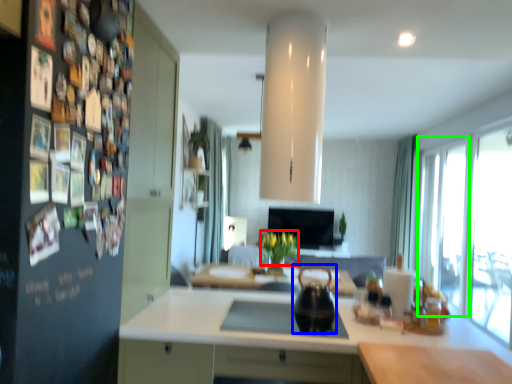
Question: Which is farther away from flower (highlighted by a red box)? tea pot (highlighted by a blue box) or glass door (highlighted by a green box)?

Choices:
 (A) tea pot
 (B) glass door

Answer: (B)